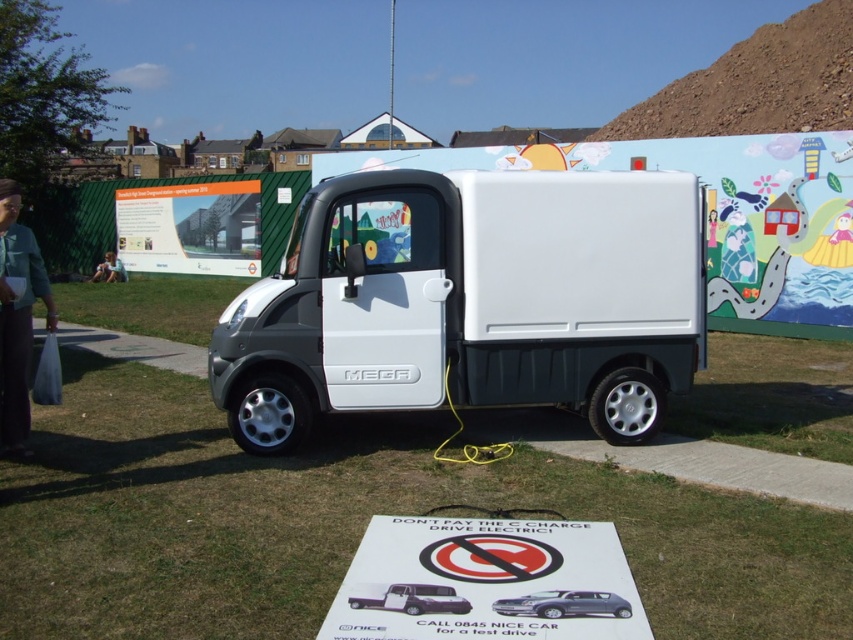
You are a driver who wants to park your car in the parking lot. You see two cars, a satin silver car at center and a metallic silver car at center. Which car is parked lower in the image?

The satin silver car at center is located below metallic silver car at center, so the satin silver car at center is parked lower in the image.

You are standing in front of the van and want to read the white paper sign at center. Which direction should you turn to face the green grass at lower center?

The green grass at lower center is to the right of the white paper sign at center, so you should turn to your right to face the green grass at lower center.

You are a driver approaching a parking lot that only allows electric vehicles. You see two cars at the center of the image, a satin silver car at center and a metallic silver car at center. According to the poster in front of the van, which car should you park behind to comply with the parking rules?

You should park behind the metallic silver car at center because it is positioned behind the satin silver car at center, indicating it is further back in the parking area and adheres to the electric vehicle requirement.